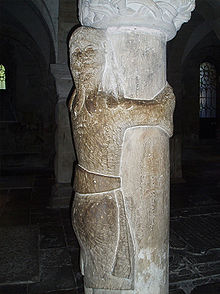
I want to click on window left side in background, so (x=3, y=75).